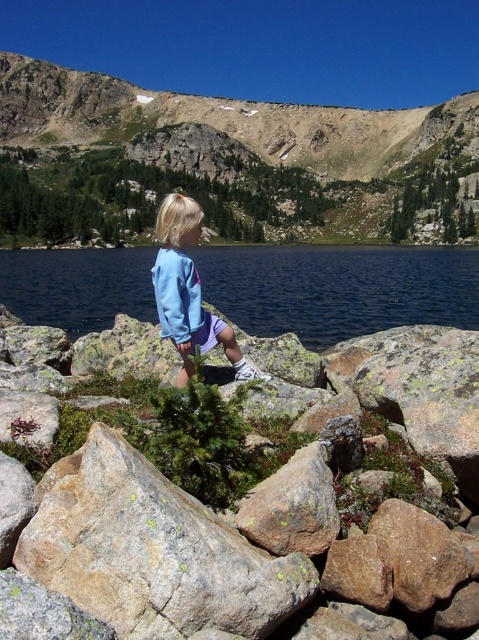
You are a photographer wanting to capture a photo of the blue fabric lake at center and the light blue fleece jacket at center. Which object should you focus on first if you want to include both in the frame without moving the camera?

The blue fabric lake at center is larger than the light blue fleece jacket at center, so you should focus on the blue fabric lake at center first to ensure it fits properly in the frame.